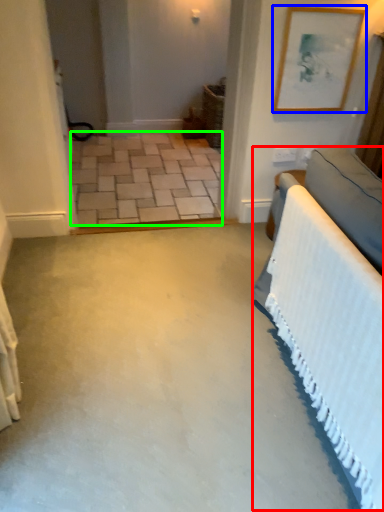
Question: Estimate the real-world distances between objects in this image. Which object is farther from bed (highlighted by a red box), picture frame (highlighted by a blue box) or concrete (highlighted by a green box)?

Choices:
 (A) picture frame
 (B) concrete

Answer: (B)